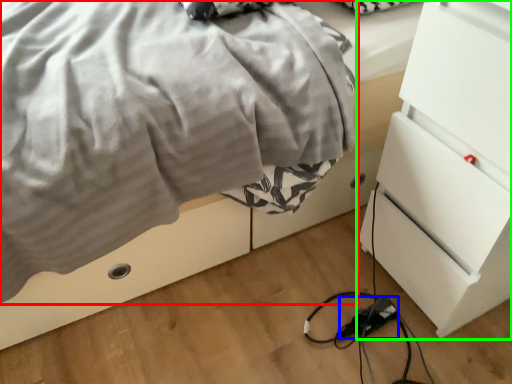
Question: Based on their relative distances, which object is farther from blanket (highlighted by a red box)? Choose from extension cord (highlighted by a blue box) and chest of drawers (highlighted by a green box).

Choices:
 (A) extension cord
 (B) chest of drawers

Answer: (A)